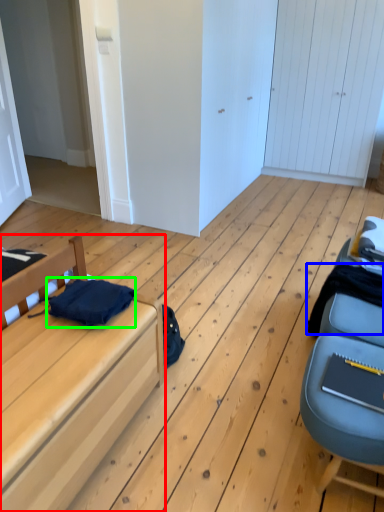
Question: Which object is positioned closest to furniture (highlighted by a red box)? Select from clothing (highlighted by a blue box) and clothing (highlighted by a green box).

Choices:
 (A) clothing
 (B) clothing

Answer: (B)